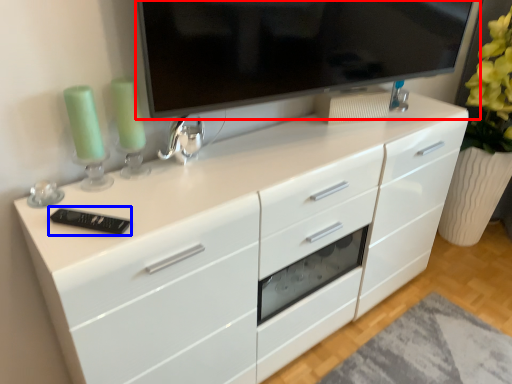
Question: Among these objects, which one is farthest to the camera, television (highlighted by a red box) or appliance (highlighted by a blue box)?

Choices:
 (A) television
 (B) appliance

Answer: (B)